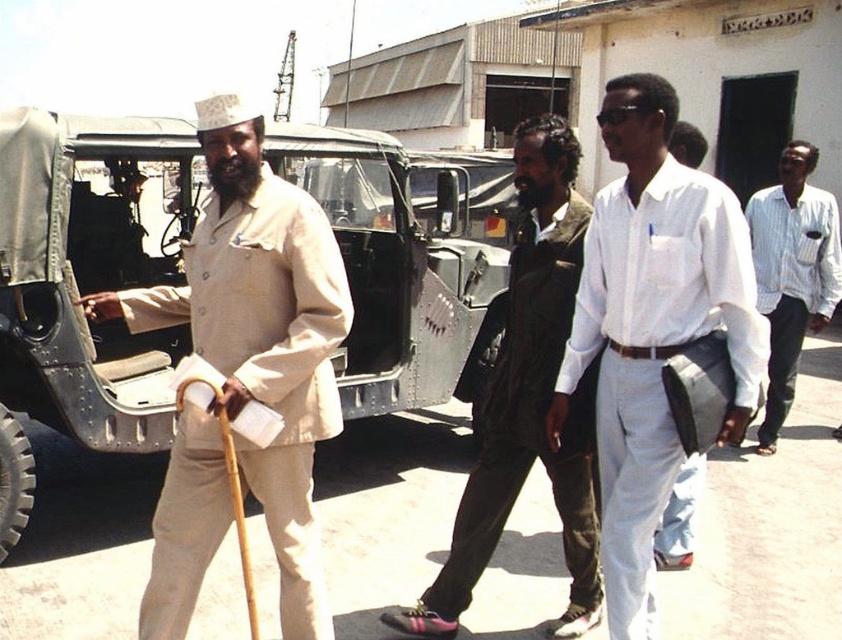
You are a photographer standing at the position of the man in traditional attire. You want to take a photo of the beige fabric coat at left and the dark brown leather jacket at center. Can you fit both items in your camera frame if your camera has a maximum horizontal field of view of 40 inches?

The beige fabric coat at left is 38.05 inches away from the dark brown leather jacket at center. Since the distance between them is less than the camera frame of 40 inches, both items can be captured in the photo.

You are a photographer trying to capture a photo of the dark brown leather jacket at center without including the beige fabric coat at left in the frame. Based on their positions, is this possible?

The beige fabric coat at left is above the dark brown leather jacket at center, so if you position your camera to focus on the lower part of the jacket while avoiding the area above it, you can exclude the beige fabric coat at left from the frame.

You are a photographer positioned at the center of the scene. You want to capture a photo of the metallic green jeep at left without including any of the people in the image. Based on their positions, is this possible?

The metallic green jeep at left is located at point (86,284), which is to the left side of the scene. Since the people are in the foreground and behind the jeep, positioning yourself centrally might allow you to frame the shot to exclude them by focusing on the left edge where the jeep is placed without overlapping with the figures.